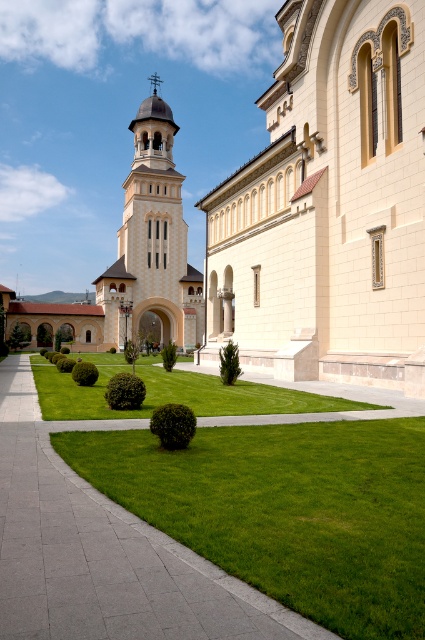
Who is lower down, green lawn at lower center or beige stone tower at center?

green lawn at lower center

From the picture: Which is above, green lawn at lower center or beige stone tower at center?

beige stone tower at center is above.

The image size is (425, 640). What do you see at coordinates (286, 509) in the screenshot?
I see `green lawn at lower center` at bounding box center [286, 509].

Identify the location of green lawn at lower center. This screenshot has height=640, width=425. [286, 509].

Is point (184, 337) farther from camera compared to point (116, 365)?

Yes.

Is beige stone tower at center wider than green lawn at center?

In fact, beige stone tower at center might be narrower than green lawn at center.

Is point (175, 298) farther from camera compared to point (144, 380)?

That is True.

You are a GUI agent. You are given a task and a screenshot of the screen. Output one action in this format:
    pyautogui.click(x=<x>, y=<y>)
    Task: Click on the beige stone tower at center
    This screenshot has width=425, height=640.
    Given the screenshot: What is the action you would take?
    pyautogui.click(x=152, y=243)

From the picture: Who is higher up, green lawn at lower center or green lawn at center?

green lawn at lower center

Is green lawn at lower center bigger than green lawn at center?

Incorrect, green lawn at lower center is not larger than green lawn at center.

Who is more distant from viewer, [399,598] or [227,408]?

The point [227,408] is behind.

I want to click on green lawn at lower center, so click(x=286, y=509).